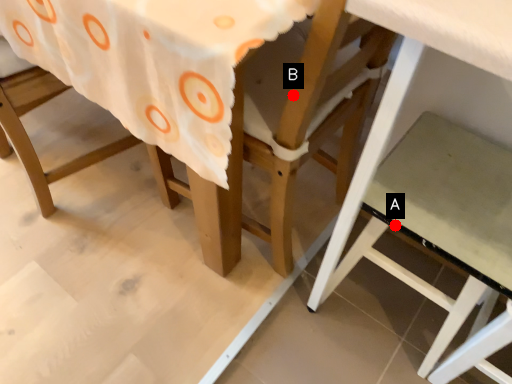
Question: Two points are circled on the image, labeled by A and B beside each circle. Which point appears closest to the camera in this image?

Choices:
 (A) A is closer
 (B) B is closer

Answer: (B)